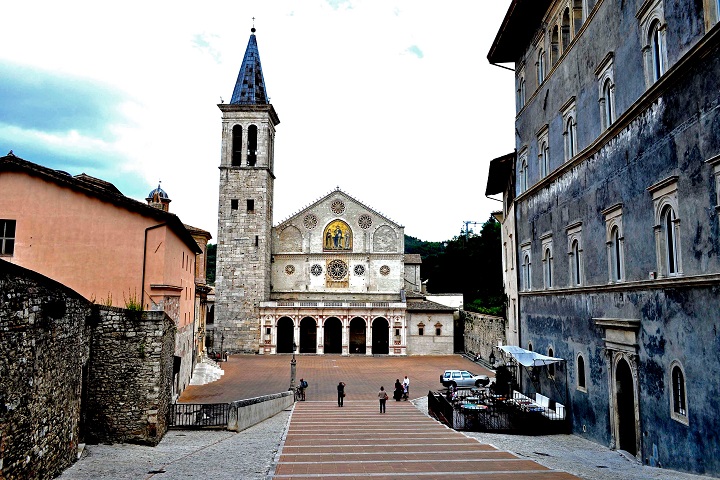
The height and width of the screenshot is (480, 720). Find the location of `1 area of seating`. 1 area of seating is located at coordinates (548, 405).